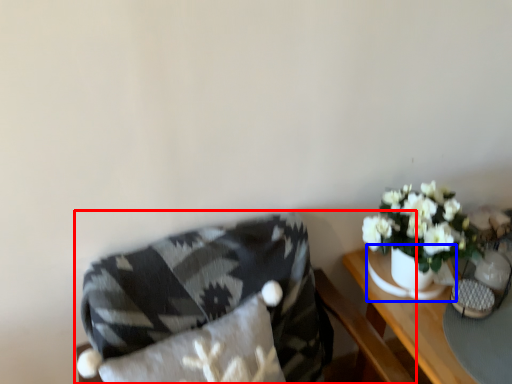
Question: Which object appears farthest to the camera in this image, chair (highlighted by a red box) or vase (highlighted by a blue box)?

Choices:
 (A) chair
 (B) vase

Answer: (B)